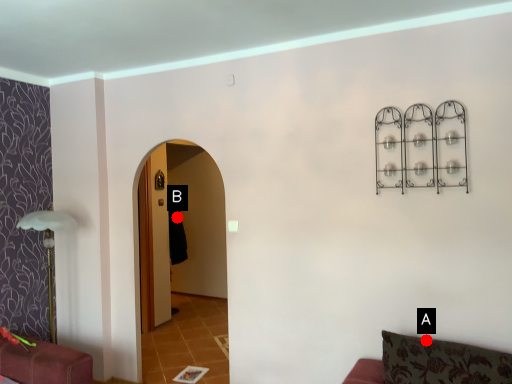
Question: Two points are circled on the image, labeled by A and B beside each circle. Which point is closer to the camera?

Choices:
 (A) A is closer
 (B) B is closer

Answer: (A)